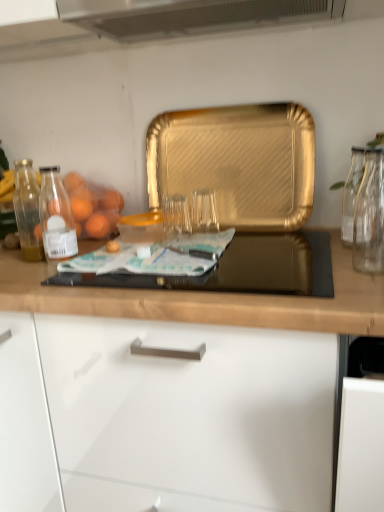
Question: Based on their positions, is transparent glass at center, the 1th glass jar from the left, located to the left or right of gold textured tray at center?

Choices:
 (A) right
 (B) left

Answer: (B)

Question: Is transparent glass at center, the 1th glass jar from the left, in front of or behind gold textured tray at center in the image?

Choices:
 (A) front
 (B) behind

Answer: (A)

Question: Estimate the real-world distances between objects in this image. Which object is closer to the clear glass vase at right, the second glass jar viewed from the left?

Choices:
 (A) transparent glass at center, which appears as the 2th glass jar when viewed from the right
 (B) black glass gas stove at center
 (C) gold textured tray at center
 (D) translucent glass oranges at left

Answer: (B)

Question: Estimate the real-world distances between objects in this image. Which object is farther from the translucent glass oranges at left?

Choices:
 (A) black glass gas stove at center
 (B) gold textured tray at center
 (C) transparent glass at center, which appears as the 2th glass jar when viewed from the right
 (D) clear glass vase at right, the second glass jar viewed from the left

Answer: (D)